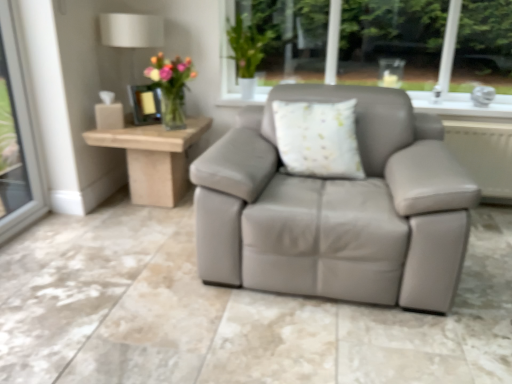
Question: Considering the positions of point (124, 137) and point (161, 84), is point (124, 137) closer or farther from the camera than point (161, 84)?

Choices:
 (A) farther
 (B) closer

Answer: (B)

Question: Visually, is light wood/roughobject at left positioned to the left or to the right of translucent glass vase at upper left?

Choices:
 (A) left
 (B) right

Answer: (A)

Question: Based on their relative distances, which object is nearer to the metallic lampshade at upper left?

Choices:
 (A) translucent glass vase at upper left
 (B) green matte vase at upper center
 (C) light wood/roughobject at left

Answer: (A)

Question: Which object is positioned farthest from the metallic lampshade at upper left?

Choices:
 (A) light wood/roughobject at left
 (B) green matte vase at upper center
 (C) translucent glass vase at upper left

Answer: (A)